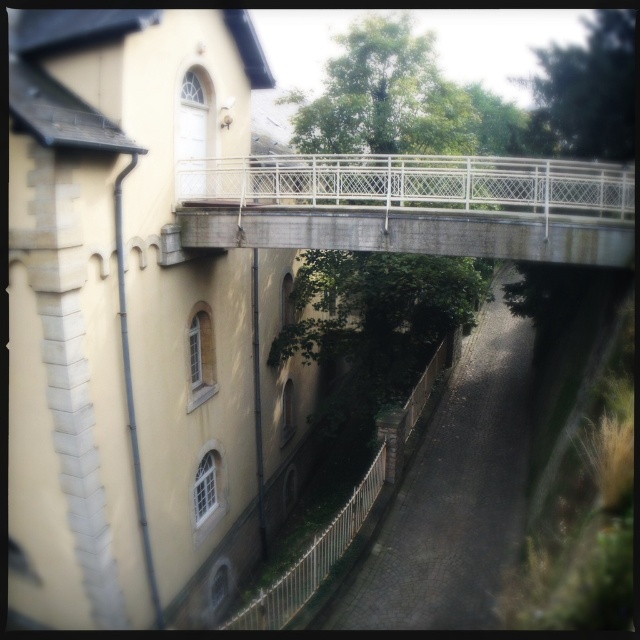
Does concrete/rustic bridge at center appear under green leafy tree at center?

Yes, concrete/rustic bridge at center is below green leafy tree at center.

This screenshot has width=640, height=640. What are the coordinates of `concrete/rustic bridge at center` in the screenshot? It's located at (412, 205).

Find the location of a particular element. concrete/rustic bridge at center is located at coordinates (412, 205).

Does green leafy tree at center have a larger size compared to green leafy tree at upper right?

Actually, green leafy tree at center might be smaller than green leafy tree at upper right.

Is point (397, 83) positioned before point (625, 61)?

No, (397, 83) is further to viewer.

Identify the location of green leafy tree at center. This screenshot has width=640, height=640. [x=385, y=97].

The height and width of the screenshot is (640, 640). What are the coordinates of `green leafy tree at center` in the screenshot? It's located at click(x=385, y=97).

Can you confirm if concrete/rustic bridge at center is positioned to the left of green leafy tree at upper right?

Indeed, concrete/rustic bridge at center is positioned on the left side of green leafy tree at upper right.

Between concrete/rustic bridge at center and green leafy tree at upper right, which one appears on the left side from the viewer's perspective?

concrete/rustic bridge at center

Which is behind, point (573, 196) or point (609, 128)?

The point (609, 128) is more distant.

Find the location of a particular element. concrete/rustic bridge at center is located at coordinates (412, 205).